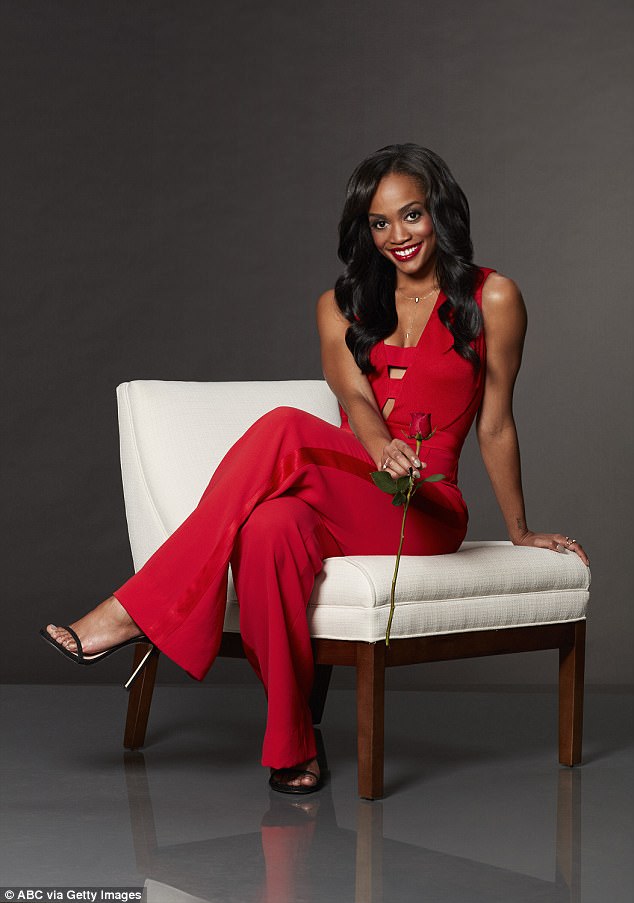
Where is `cushion`? This screenshot has width=634, height=903. cushion is located at coordinates (370, 583).